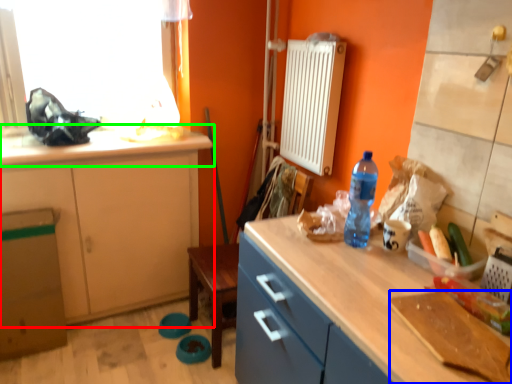
Question: Which object is positioned farthest from cabinetry (highlighted by a red box)? Select from cutting board (highlighted by a blue box) and countertop (highlighted by a green box).

Choices:
 (A) cutting board
 (B) countertop

Answer: (A)